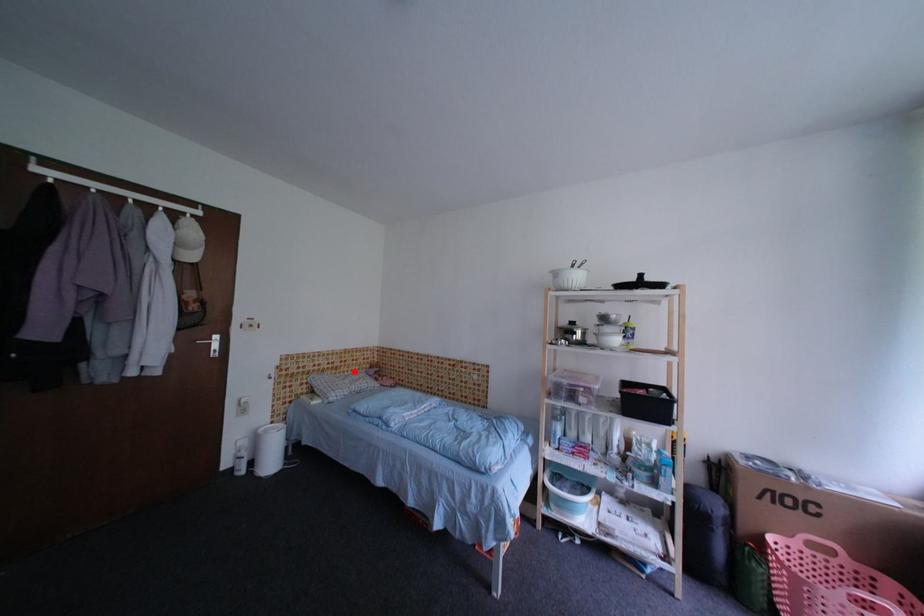
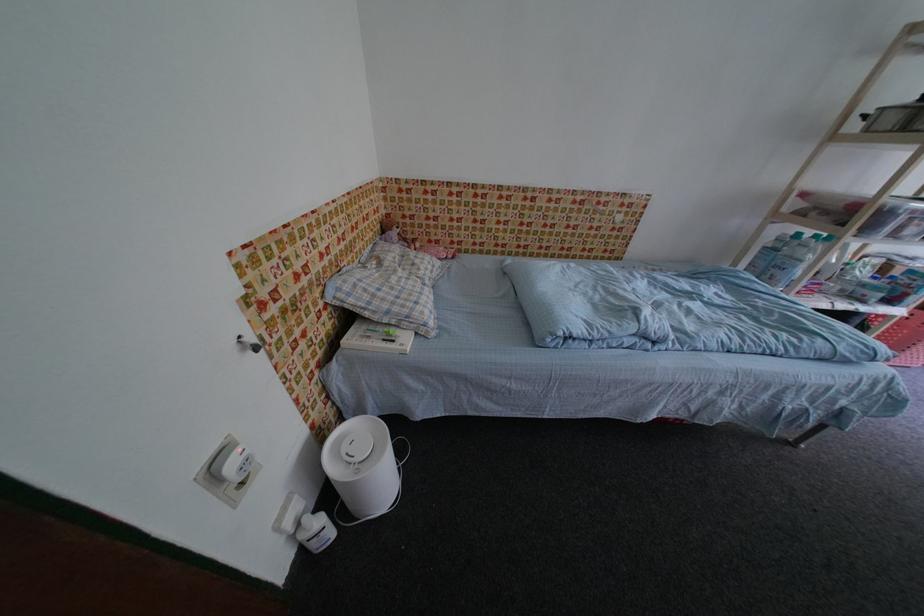
Question: I am providing you with two images of the same scene from different viewpoints. In image1, a red point is highlighted. Considering the same 3D point in image2, which of the following is correct?

Choices:
 (A) It is closer
 (B) It is farther

Answer: (A)